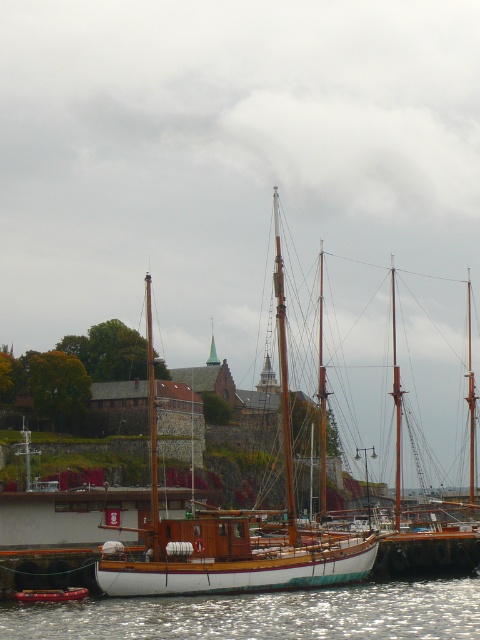
Is glistening water at lower left in front of wooden sailboat at center?

Yes, glistening water at lower left is in front of wooden sailboat at center.

Is point (112, 620) closer to camera compared to point (179, 538)?

Yes, it is in front of point (179, 538).

Image resolution: width=480 pixels, height=640 pixels. I want to click on glistening water at lower left, so click(263, 614).

From the picture: Who is lower down, wooden sailboat at center or wooden boat at lower center?

wooden boat at lower center is lower down.

Between wooden sailboat at center and wooden boat at lower center, which one appears on the right side from the viewer's perspective?

From the viewer's perspective, wooden sailboat at center appears more on the right side.

Is point (375, 545) positioned in front of point (31, 600)?

No, (375, 545) is behind (31, 600).

The image size is (480, 640). I want to click on wooden sailboat at center, so click(x=235, y=531).

Is glistening water at lower left further to the viewer compared to wooden boat at lower center?

No, it is not.

Does point (367, 632) lie in front of point (20, 595)?

Yes.

Find the location of a particular element. The height and width of the screenshot is (640, 480). glistening water at lower left is located at coordinates (263, 614).